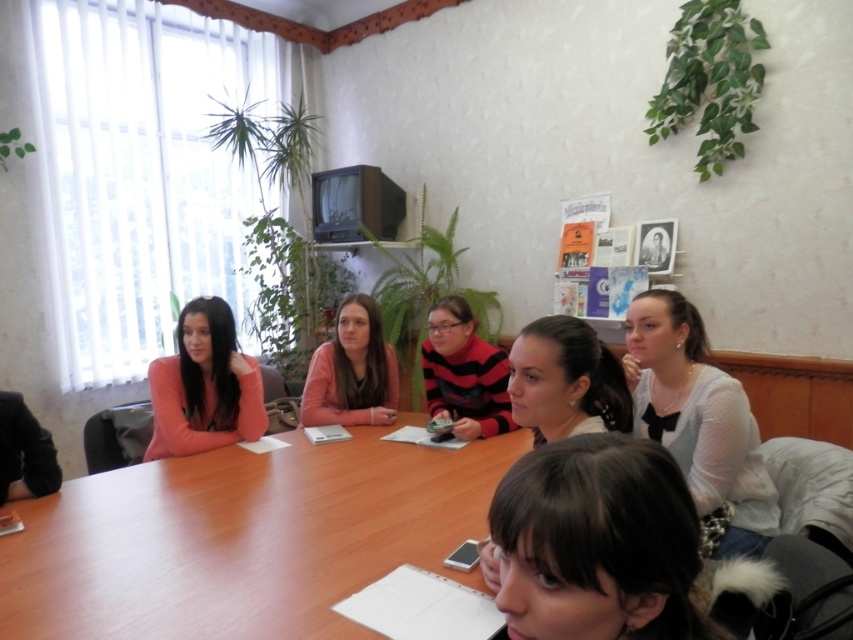
Does point (247, 380) come farther from viewer compared to point (572, 356)?

Yes, point (247, 380) is behind point (572, 356).

Who is taller, matte orange shirt at left or smooth brown hair at center?

matte orange shirt at left is taller.

Which is behind, point (190, 440) or point (619, 385)?

The point (190, 440) is behind.

Locate an element on the screen. Image resolution: width=853 pixels, height=640 pixels. matte orange shirt at left is located at coordinates (204, 385).

Which is more to the right, smooth brown hair at center or striped sweater at center?

smooth brown hair at center is more to the right.

Does smooth brown hair at center have a larger size compared to striped sweater at center?

Incorrect, smooth brown hair at center is not larger than striped sweater at center.

The image size is (853, 640). Find the location of `smooth brown hair at center`. smooth brown hair at center is located at coordinates (566, 380).

Based on the photo, who is higher up, striped sweater at center or matte pink sweater at center?

Positioned higher is matte pink sweater at center.

Which is more to the right, striped sweater at center or matte pink sweater at center?

striped sweater at center is more to the right.

Which is behind, point (460, 432) or point (396, 394)?

The point (396, 394) is more distant.

The image size is (853, 640). What are the coordinates of `striped sweater at center` in the screenshot? It's located at (463, 372).